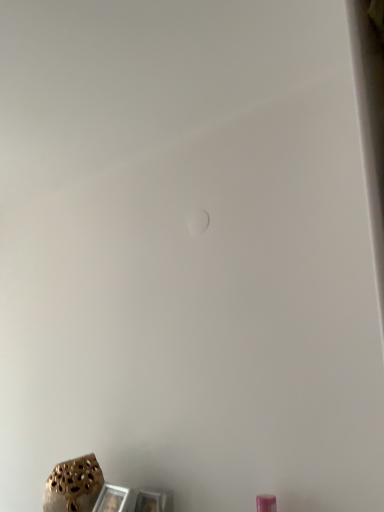
Looking at this image, measure the distance between point (107, 498) and camera.

The depth of point (107, 498) is 1.21 meters.

In order to face metallic silver picture frame at lower left, should I rotate leftwards or rightwards?

You should rotate left by 11.672 degrees.

What do you see at coordinates (112, 499) in the screenshot? This screenshot has height=512, width=384. I see `metallic silver picture frame at lower left` at bounding box center [112, 499].

Locate an element on the screen. metallic silver picture frame at lower left is located at coordinates (112, 499).

Identify the location of metallic silver picture frame at lower left. (112, 499).